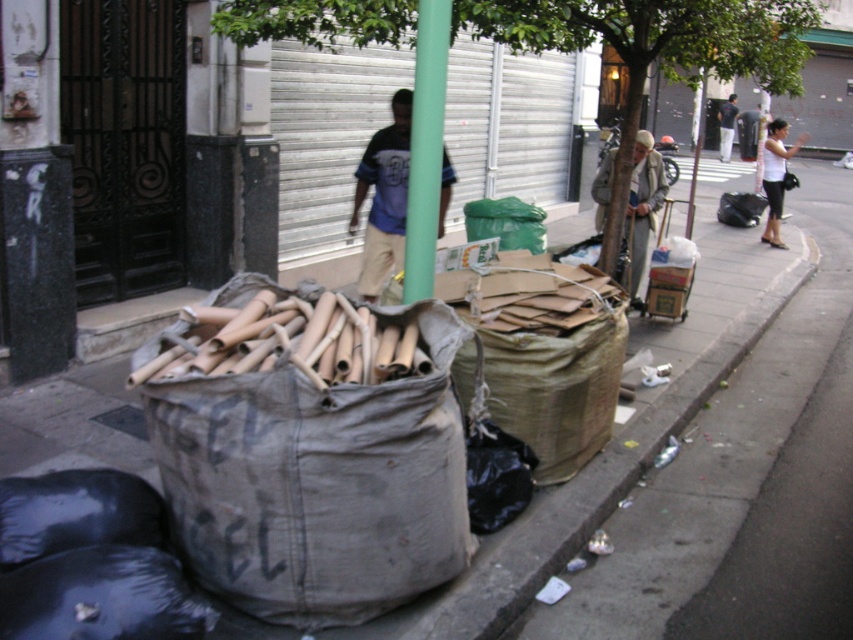
Question: Is black plastic bag at right wider than dark blue shirt at center?

Choices:
 (A) no
 (B) yes

Answer: (A)

Question: Which of the following is the closest to the observer?

Choices:
 (A) green plastic bag at center
 (B) matte blue shirt at center

Answer: (B)

Question: Which object is farther from the camera taking this photo?

Choices:
 (A) gray woolen sweater at center
 (B) matte blue shirt at center
 (C) green leafy tree at center

Answer: (B)

Question: Does green matte pole at center have a smaller size compared to matte blue shirt at center?

Choices:
 (A) yes
 (B) no

Answer: (A)

Question: Is green leafy tree at center to the left of gray woolen sweater at center from the viewer's perspective?

Choices:
 (A) no
 (B) yes

Answer: (B)

Question: Which point is closer to the camera?

Choices:
 (A) green plastic bag at center
 (B) green matte pole at center
 (C) matte blue shirt at center

Answer: (B)